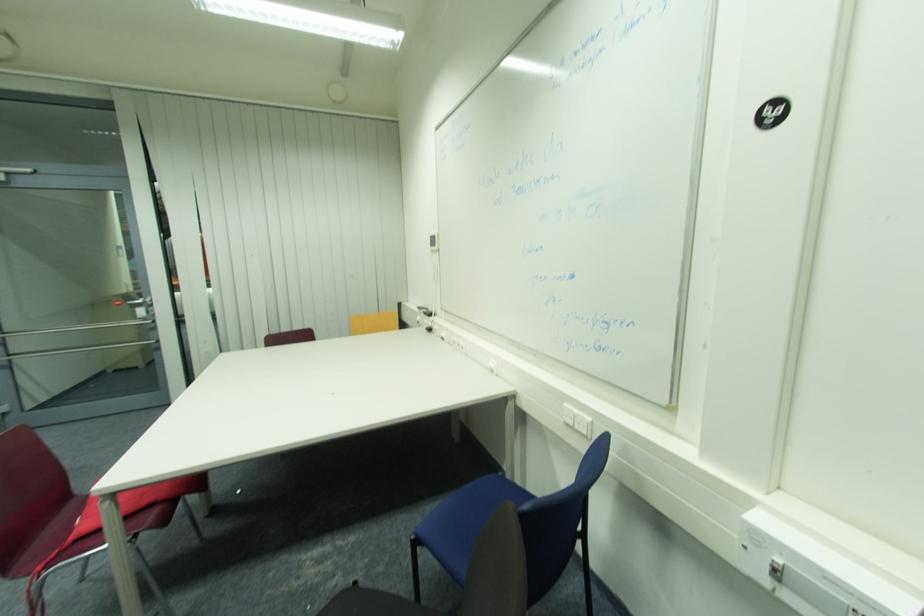
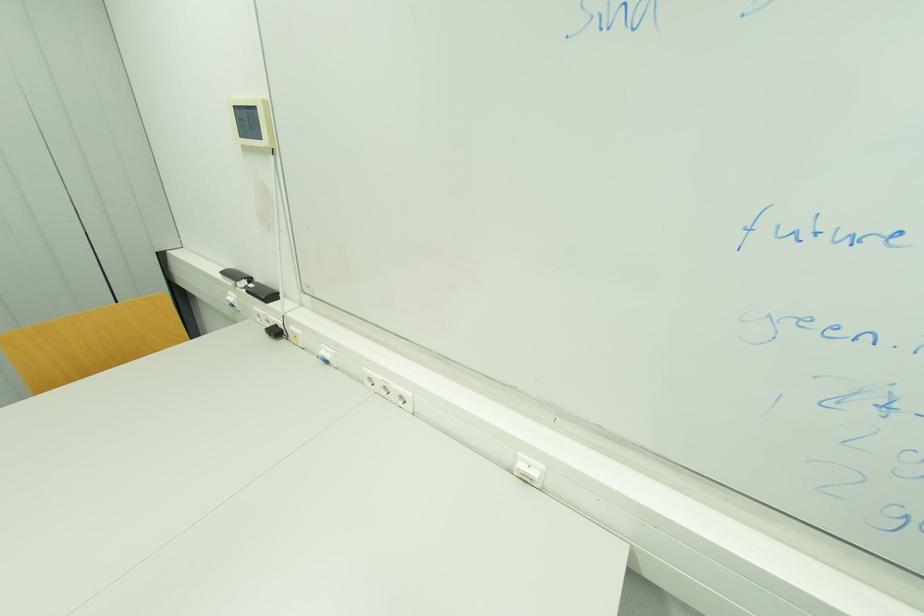
The point at (433, 331) is marked in the first image. Where is the corresponding point in the second image?

(281, 333)